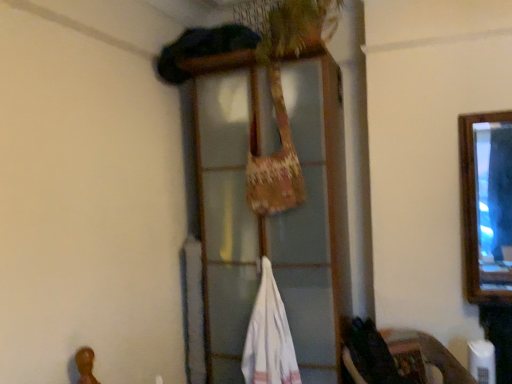
Question: From the image's perspective, would you say white cotton towel at center is shown under wooden frame at center?

Choices:
 (A) no
 (B) yes

Answer: (B)

Question: Does white cotton towel at center appear on the left side of wooden frame at center?

Choices:
 (A) yes
 (B) no

Answer: (A)

Question: Would you say white cotton towel at center is outside wooden frame at center?

Choices:
 (A) yes
 (B) no

Answer: (B)

Question: From a real-world perspective, is white cotton towel at center below wooden frame at center?

Choices:
 (A) no
 (B) yes

Answer: (B)

Question: Does white cotton towel at center have a greater height compared to wooden frame at center?

Choices:
 (A) yes
 (B) no

Answer: (B)

Question: Can you confirm if white cotton towel at center is shorter than wooden frame at center?

Choices:
 (A) yes
 (B) no

Answer: (A)

Question: Is the position of wooden frame at center less distant than that of white cotton towel at center?

Choices:
 (A) yes
 (B) no

Answer: (A)

Question: Is white cotton towel at center a part of wooden frame at center?

Choices:
 (A) yes
 (B) no

Answer: (A)

Question: From the image's perspective, is wooden frame at center above white cotton towel at center?

Choices:
 (A) no
 (B) yes

Answer: (B)

Question: Is wooden frame at center far away from white cotton towel at center?

Choices:
 (A) yes
 (B) no

Answer: (B)

Question: Is wooden frame at center completely or partially outside of white cotton towel at center?

Choices:
 (A) yes
 (B) no

Answer: (A)

Question: Is wooden frame at center shorter than white cotton towel at center?

Choices:
 (A) no
 (B) yes

Answer: (A)

Question: Considering the positions of wooden frame at center and white cotton towel at center in the image, is wooden frame at center taller or shorter than white cotton towel at center?

Choices:
 (A) short
 (B) tall

Answer: (B)